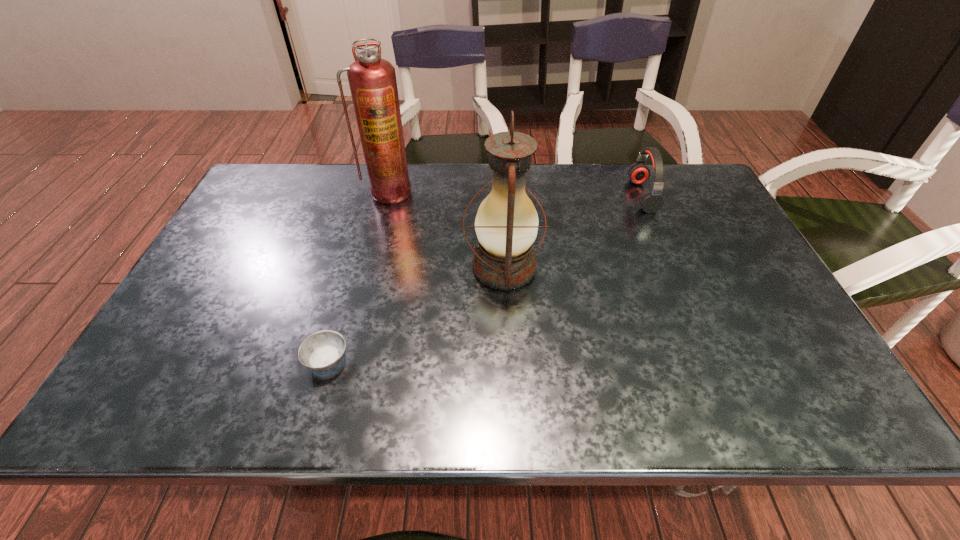
Identify the location of vacant position located on the ear cups of the rightmost object. This screenshot has width=960, height=540. (x=587, y=195).

At what (x,y) coordinates should I click in order to perform the action: click on free spot located 0.390m on the ear cups of the rightmost object. Please return your answer as a coordinate pair (x, y). The width and height of the screenshot is (960, 540). Looking at the image, I should click on 505,195.

Identify the location of free space located on the right of the ashtray. The image size is (960, 540). (444, 360).

Locate an element on the screen. The width and height of the screenshot is (960, 540). fire extinguisher positioned at the far edge is located at coordinates (372, 80).

You are a GUI agent. You are given a task and a screenshot of the screen. Output one action in this format:
    pyautogui.click(x=<x>, y=<y>)
    Task: Click on the earphone present at the far edge
    
    Given the screenshot: What is the action you would take?
    pyautogui.click(x=651, y=201)

Locate an element on the screen. This screenshot has height=540, width=960. object situated at the near edge is located at coordinates (322, 351).

Identify the location of vacant space at the far edge. (548, 174).

Where is `vacant area at the near edge`? The image size is (960, 540). vacant area at the near edge is located at coordinates (608, 390).

Image resolution: width=960 pixels, height=540 pixels. I want to click on free point at the left edge, so click(x=190, y=343).

You are a GUI agent. You are given a task and a screenshot of the screen. Output one action in this format:
    pyautogui.click(x=<x>, y=<y>)
    Task: Click on the free space at the right edge
    This screenshot has height=540, width=960.
    Given the screenshot: What is the action you would take?
    pyautogui.click(x=709, y=266)